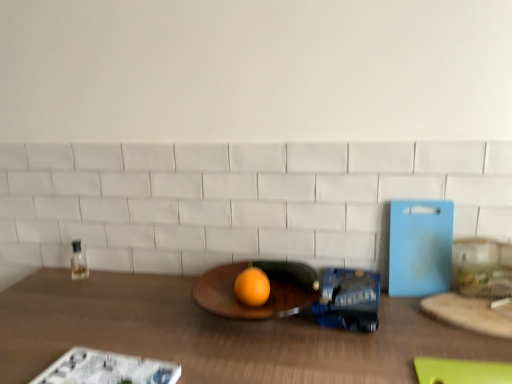
Question: Considering the relative sizes of wooden table at center and wooden cutting board at right in the image provided, is wooden table at center taller than wooden cutting board at right?

Choices:
 (A) yes
 (B) no

Answer: (A)

Question: From a real-world perspective, is wooden table at center on top of wooden cutting board at right?

Choices:
 (A) no
 (B) yes

Answer: (A)

Question: Is wooden table at center outside of wooden cutting board at right?

Choices:
 (A) yes
 (B) no

Answer: (A)

Question: Does wooden table at center have a larger size compared to wooden cutting board at right?

Choices:
 (A) yes
 (B) no

Answer: (A)

Question: Considering the relative positions of wooden table at center and wooden cutting board at right in the image provided, is wooden table at center behind wooden cutting board at right?

Choices:
 (A) no
 (B) yes

Answer: (A)

Question: From the image's perspective, relative to clear glass bottle at left, is orange matte grapefruit at center above or below?

Choices:
 (A) above
 (B) below

Answer: (B)

Question: Do you think orange matte grapefruit at center is within clear glass bottle at left, or outside of it?

Choices:
 (A) outside
 (B) inside

Answer: (A)

Question: From a real-world perspective, is orange matte grapefruit at center positioned above or below clear glass bottle at left?

Choices:
 (A) below
 (B) above

Answer: (B)

Question: Considering the positions of orange matte grapefruit at center and clear glass bottle at left in the image, is orange matte grapefruit at center wider or thinner than clear glass bottle at left?

Choices:
 (A) thin
 (B) wide

Answer: (B)

Question: Considering the positions of clear glass bottle at left and wooden table at center in the image, is clear glass bottle at left bigger or smaller than wooden table at center?

Choices:
 (A) big
 (B) small

Answer: (B)

Question: Considering the positions of clear glass bottle at left and wooden table at center in the image, is clear glass bottle at left taller or shorter than wooden table at center?

Choices:
 (A) short
 (B) tall

Answer: (A)

Question: Is point click(73, 248) closer or farther from the camera than point click(132, 291)?

Choices:
 (A) closer
 (B) farther

Answer: (B)

Question: Is clear glass bottle at left spatially inside wooden table at center, or outside of it?

Choices:
 (A) outside
 (B) inside

Answer: (A)

Question: In the image, is wooden cutting board at right positioned in front of or behind wooden table at center?

Choices:
 (A) front
 (B) behind

Answer: (B)

Question: Do you think wooden cutting board at right is within wooden table at center, or outside of it?

Choices:
 (A) outside
 (B) inside

Answer: (B)